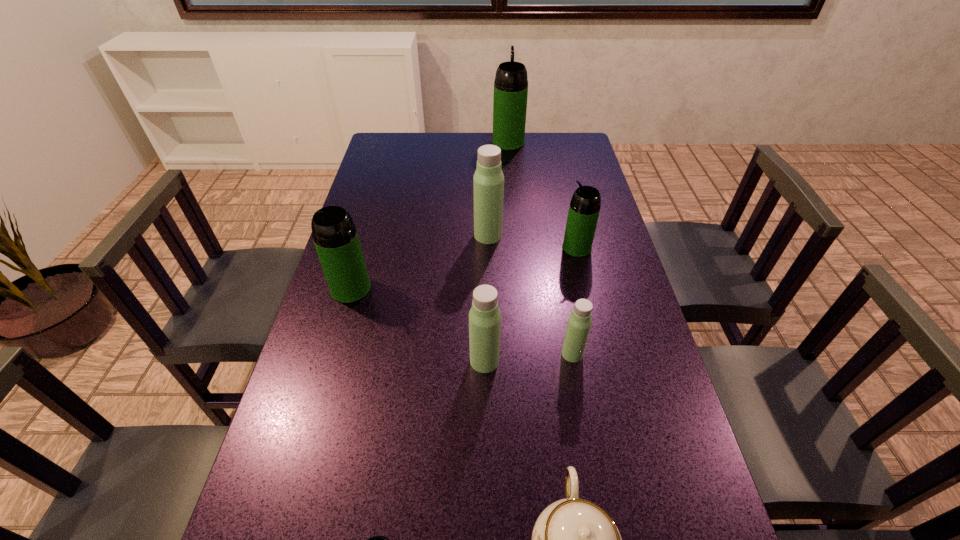
Identify the location of free spot located from the spout of the leftmost object. (328, 366).

Locate an element on the screen. free space located 0.070m on the back of the biggest light thermos bottle is located at coordinates (488, 214).

Where is `vacant space located 0.150m from the spout of the rightmost object`? Image resolution: width=960 pixels, height=540 pixels. vacant space located 0.150m from the spout of the rightmost object is located at coordinates 514,248.

Identify the location of free region located from the spout of the rightmost object. (471, 248).

Where is `free location located 0.360m from the spout of the rightmost object`? free location located 0.360m from the spout of the rightmost object is located at coordinates (445, 248).

The height and width of the screenshot is (540, 960). Identify the location of free space located on the right of the second biggest light thermos bottle. (652, 361).

At what (x,y) coordinates should I click in order to perform the action: click on free space located 0.250m on the back of the smallest light thermos bottle. Please return your answer as a coordinate pair (x, y). This screenshot has height=540, width=960. Looking at the image, I should click on (558, 274).

Image resolution: width=960 pixels, height=540 pixels. Find the location of `object that is at the far edge`. object that is at the far edge is located at coordinates (511, 82).

Locate an element on the screen. The height and width of the screenshot is (540, 960). object at the left edge is located at coordinates (335, 236).

This screenshot has height=540, width=960. Identify the location of object positioned at the right edge. (584, 209).